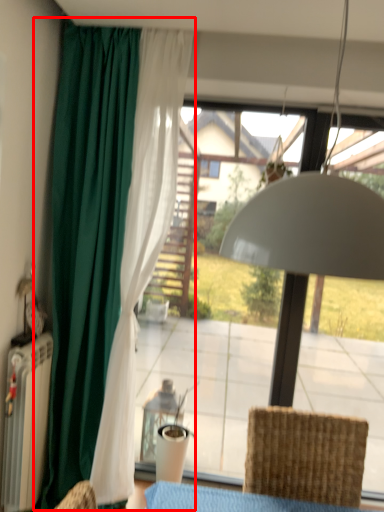
Question: Where is curtain (annotated by the red box) located in relation to chair in the image?

Choices:
 (A) left
 (B) right

Answer: (A)